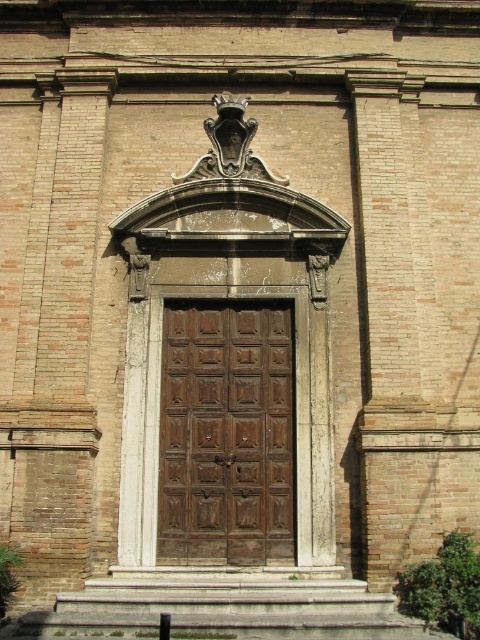
Looking at this image, who is more forward, (252, 403) or (385, 602)?

Point (385, 602) is in front.

Who is more distant from viewer, (287, 307) or (107, 608)?

The point (287, 307) is more distant.

Where is `dark brown wood door at center`? dark brown wood door at center is located at coordinates tap(227, 433).